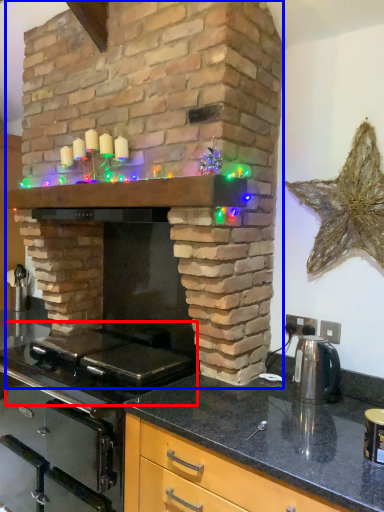
Question: Which object is closer to the camera taking this photo, gas stove (highlighted by a red box) or fireplace (highlighted by a blue box)?

Choices:
 (A) gas stove
 (B) fireplace

Answer: (B)